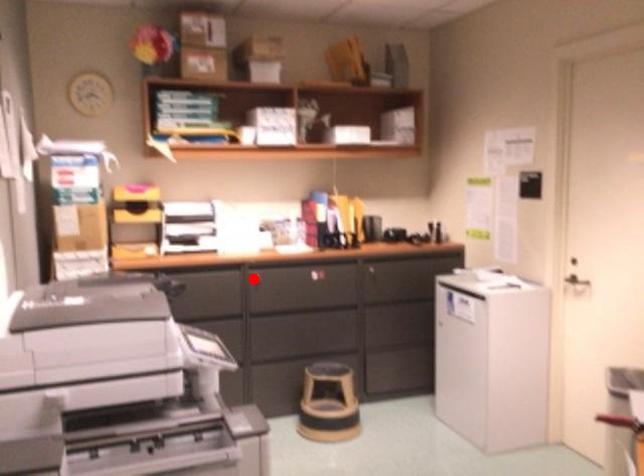
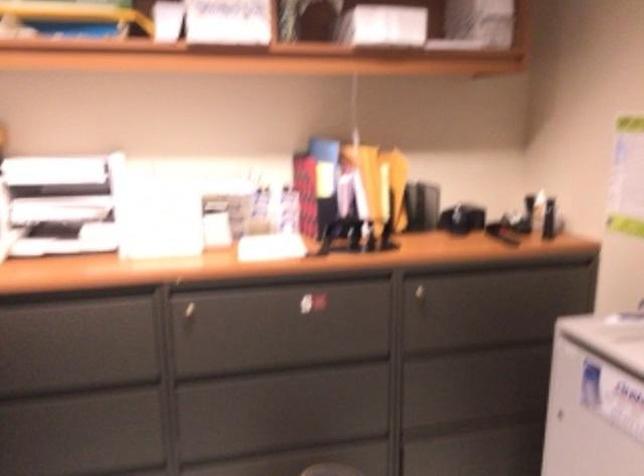
Find the pixel in the second image that matches the highlighted location in the first image.

(185, 307)